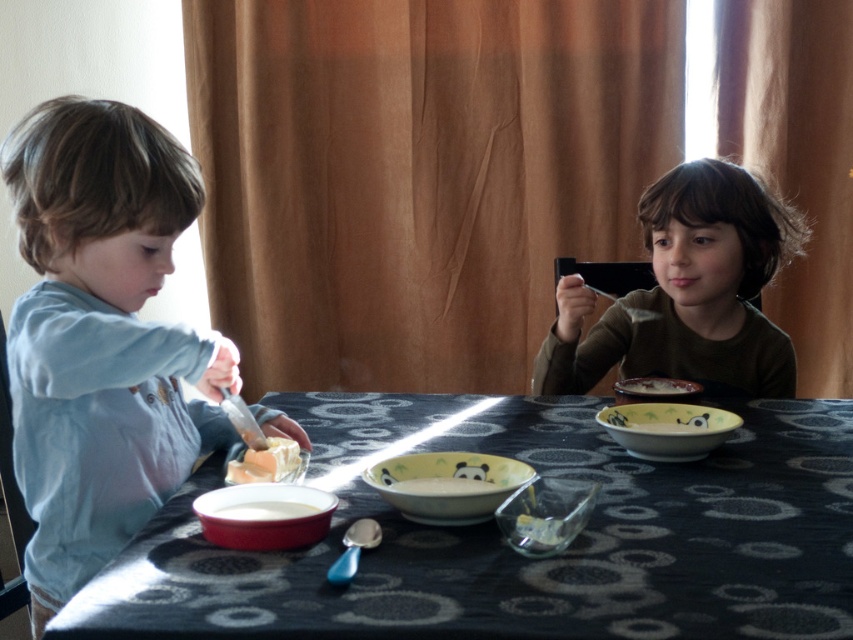
You are a parent trying to serve soup to your child. You have the matte ceramic bowl at center and the white creamy soup at lower left. Which container should you use to serve the soup?

The white creamy soup at lower left is in the smaller container, so you should use the matte ceramic bowl at center to serve the soup since it is taller and can hold more liquid.

You are a parent trying to serve soup to your child. The white creamy soup at lower left is too far from the matte green bowl at center. Can you pour the soup into the bowl without spilling?

The distance between the matte green bowl at center and the white creamy soup at lower left is 6.52 inches. Since this distance is relatively short, you can carefully pour the soup into the bowl without spilling.